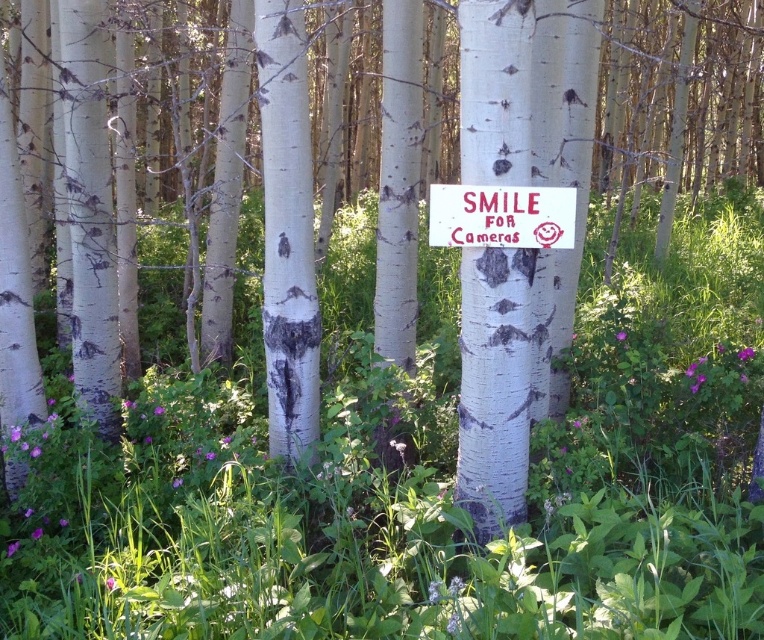
Can you confirm if white bark tree trunk at center is positioned to the right of white painted wood sign at center?

Yes, white bark tree trunk at center is to the right of white painted wood sign at center.

Is white bark tree trunk at center behind white painted wood sign at center?

No, it is not.

The width and height of the screenshot is (764, 640). Identify the location of white bark tree trunk at center. (500, 378).